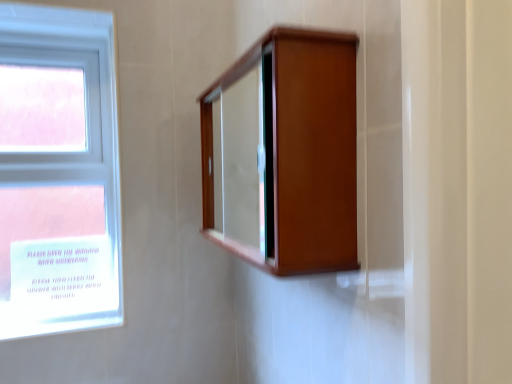
You are a GUI agent. You are given a task and a screenshot of the screen. Output one action in this format:
    pyautogui.click(x=<x>, y=<y>)
    Task: Click on the matte wood cabinet at center
    The image size is (512, 384).
    Given the screenshot: What is the action you would take?
    pyautogui.click(x=284, y=153)

Describe the element at coordinates (284, 153) in the screenshot. I see `matte wood cabinet at center` at that location.

This screenshot has width=512, height=384. I want to click on matte wood cabinet at center, so click(284, 153).